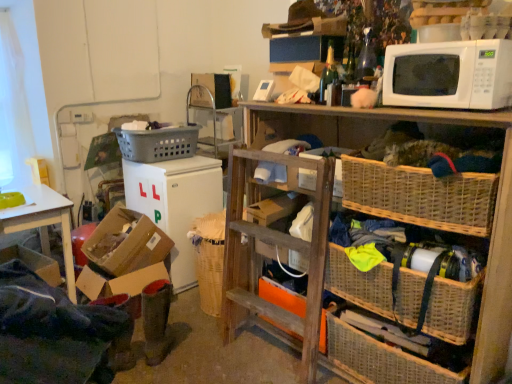
Question: In terms of size, does woven wicker basket at lower right appear bigger or smaller than cardboard box at lower left, which appears as the first box when ordered from the bottom?

Choices:
 (A) small
 (B) big

Answer: (B)

Question: From a real-world perspective, is woven wicker basket at lower right physically located above or below cardboard box at lower left, which appears as the first box when ordered from the bottom?

Choices:
 (A) above
 (B) below

Answer: (A)

Question: Which is farther from the orange cardboard box at center?

Choices:
 (A) woven wicker basket at lower right
 (B) woven wicker picnic basket at lower right, which ranks as the second picnic basket in back-to-front order
 (C) green glass bottle at upper center
 (D) white matte microwave at upper right
 (E) woven wood shelf at upper right

Answer: (D)

Question: Which of these objects is positioned farthest from the cardboard box at lower left, which appears as the first box when ordered from the bottom?

Choices:
 (A) woven wicker picnic basket at lower right, the 3th picnic basket in the left-to-right sequence
 (B) cardboard box at lower left, the second box from the bottom
 (C) orange cardboard box at center
 (D) gray plastic laundry basket at upper left, which ranks as the first picnic basket in top-to-bottom order
 (E) white matte refrigerator at lower left

Answer: (A)